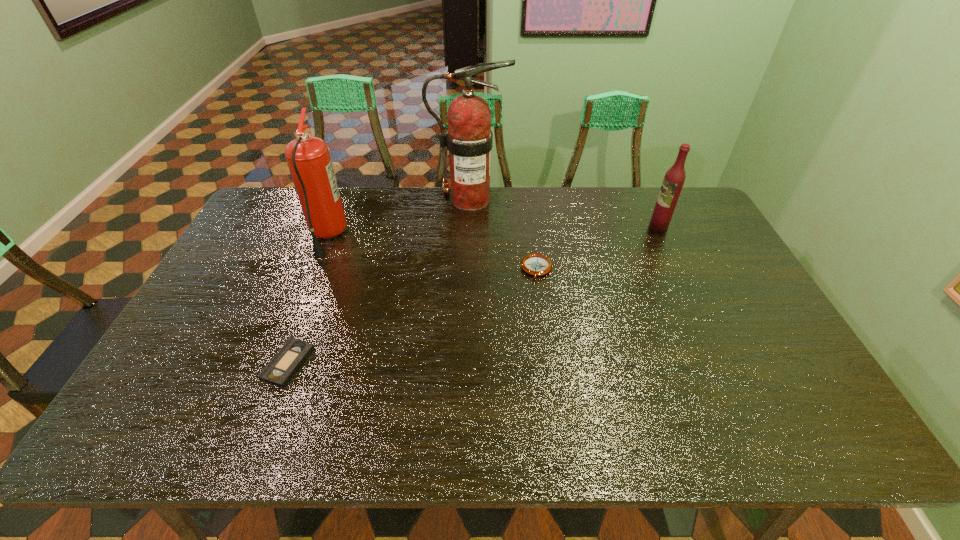
This screenshot has height=540, width=960. What are the coordinates of `vacant space that satisfies the following two spatial constraints: 1. at the nozzle of the compass; 2. on the left side of the farthest object` in the screenshot? It's located at (468, 269).

The width and height of the screenshot is (960, 540). Find the location of `free location that satisfies the following two spatial constraints: 1. on the instruction side of the left fire extinguisher; 2. on the back side of the shortest object`. free location that satisfies the following two spatial constraints: 1. on the instruction side of the left fire extinguisher; 2. on the back side of the shortest object is located at coordinates (276, 364).

At what (x,y) coordinates should I click in order to perform the action: click on vacant space that satisfies the following two spatial constraints: 1. at the nozzle of the compass; 2. on the left side of the taller fire extinguisher. Please return your answer as a coordinate pair (x, y). The height and width of the screenshot is (540, 960). Looking at the image, I should click on (468, 269).

The image size is (960, 540). What are the coordinates of `free space that satisfies the following two spatial constraints: 1. on the instruction side of the left fire extinguisher; 2. on the right side of the fourth tallest object` in the screenshot? It's located at (314, 269).